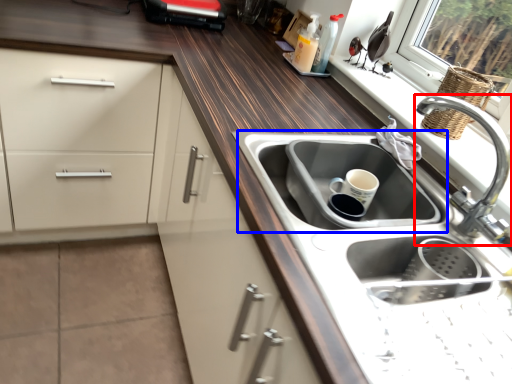
Question: Which point is closer to the camera, tap (highlighted by a red box) or sink (highlighted by a blue box)?

Choices:
 (A) tap
 (B) sink

Answer: (A)